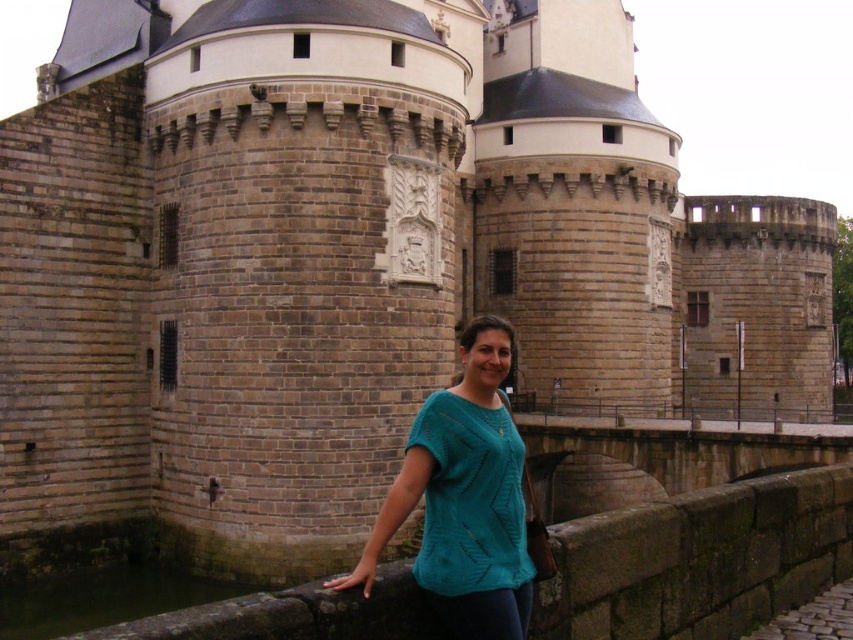
Between teal knitted shirt at center and dark brown water at lower left, which one appears on the right side from the viewer's perspective?

teal knitted shirt at center

Is point (444, 396) positioned before point (45, 627)?

Yes, it is.

Is point (498, 433) positioned in front of point (12, 596)?

Yes, it is in front of point (12, 596).

This screenshot has width=853, height=640. In order to click on teal knitted shirt at center in this screenshot , I will do `click(463, 499)`.